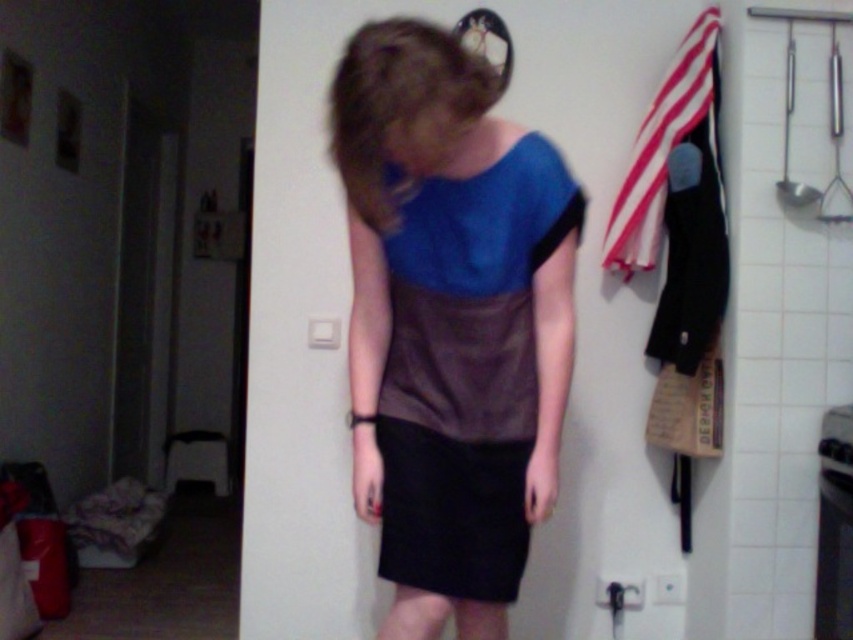
You are a delivery robot with a package that is 1.2 meters wide. You need to pass through the space between the person and the matte blue fabric at center. Can you fit through?

The distance between the person and the matte blue fabric at center is 1.18 meters, which is narrower than the package width of 1.2 meters. Therefore, the robot cannot fit through the space between the person and the matte blue fabric at center.

From the picture: You are a delivery robot in a kitchen. You need to place a package on the counter between the matte blue fabric at center and the red striped fabric at upper right. The package is 1 meter long. Will it fit between them?

The distance between the matte blue fabric at center and the red striped fabric at upper right is 1.04 meters, so the 1 meter long package will fit between them.

You are a delivery robot with a package that is 1.2 meters long. You need to move through the kitchen and deliver it to the area near the red striped fabric at upper right. Can you carry the package horizontally while moving past the black matte skirt at center?

The distance between the black matte skirt at center and the red striped fabric at upper right is 1.09 meters. Since the package is 1.2 meters long, it is longer than the available space, so you cannot carry it horizontally through that path.